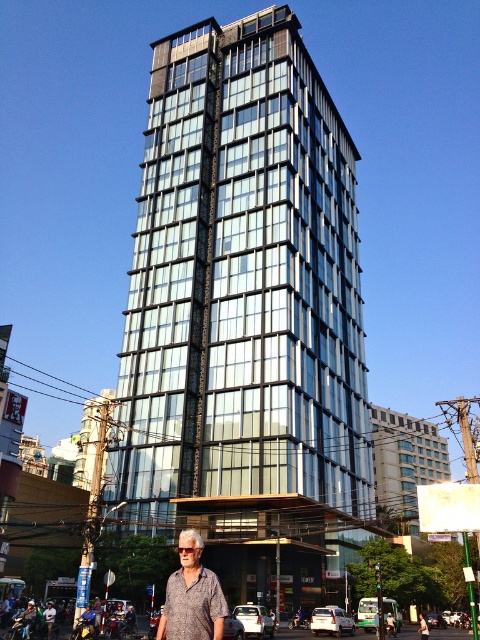
You are a photographer standing on the sidewalk. You want to take a photo of the glassy steel building at center without including the printed cotton shirt at center in the frame. Is this possible given their positions?

The glassy steel building at center is located above the printed cotton shirt at center, so yes, the photographer can angle the camera upwards to capture the glassy steel building at center while excluding the printed cotton shirt at center from the frame.

You are a city planner analyzing the urban layout. Given that the glassy steel building at center and the printed cotton shirt at center are both visible from the same vantage point, which one would you estimate occupies more physical space in the scene?

The glassy steel building at center has a larger size compared to the printed cotton shirt at center, so it occupies more physical space in the scene.

You are a pedestrian standing on the sidewalk. You see the glassy steel building at center and the printed cotton shirt at center. Which object is positioned to the right of the other?

The glassy steel building at center is to the right of the printed cotton shirt at center.